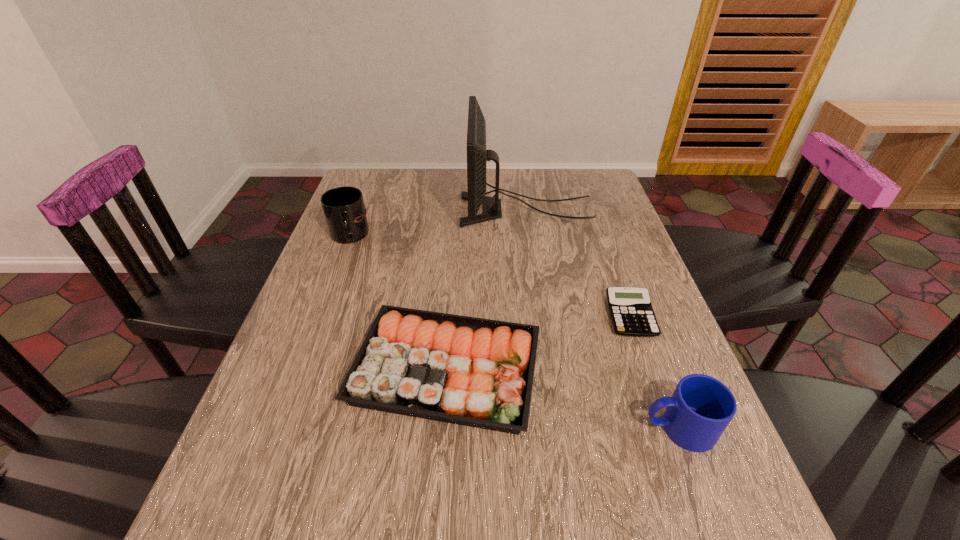
Locate an element on the screen. The width and height of the screenshot is (960, 540). vacant space that is in between the tallest object and the shorter mug is located at coordinates (603, 319).

The height and width of the screenshot is (540, 960). Identify the location of vacant area that lies between the platter and the shortest object. (539, 343).

Identify the location of blank region between the computer monitor and the platter. (486, 289).

Image resolution: width=960 pixels, height=540 pixels. Identify the location of free space between the calculator and the computer monitor. (579, 263).

I want to click on unoccupied area between the leftmost object and the calculator, so click(x=490, y=276).

Where is `free area in between the second shortest object and the third tallest object`? free area in between the second shortest object and the third tallest object is located at coordinates (563, 399).

Where is `the fourth closest object to the shortest object`? Image resolution: width=960 pixels, height=540 pixels. the fourth closest object to the shortest object is located at coordinates click(x=344, y=210).

Locate an element on the screen. the third closest object relative to the tallest object is located at coordinates (475, 372).

Locate an element on the screen. vacant space that satisfies the following two spatial constraints: 1. on the screen side of the tallest object; 2. with the handle on the side of the left mug is located at coordinates (530, 237).

The height and width of the screenshot is (540, 960). In order to click on free space that satisfies the following two spatial constraints: 1. on the back side of the calculator; 2. on the screen side of the computer monitor in this screenshot , I will do click(x=593, y=210).